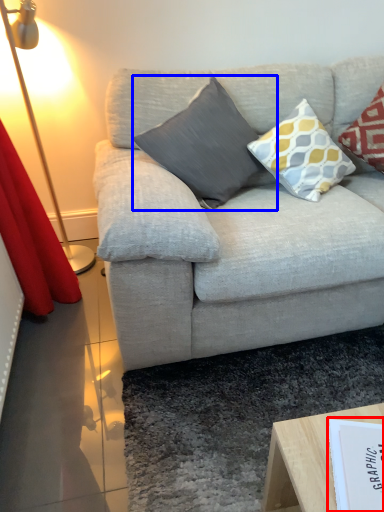
Question: Which object is further to the camera taking this photo, paperback book (highlighted by a red box) or pillow (highlighted by a blue box)?

Choices:
 (A) paperback book
 (B) pillow

Answer: (B)